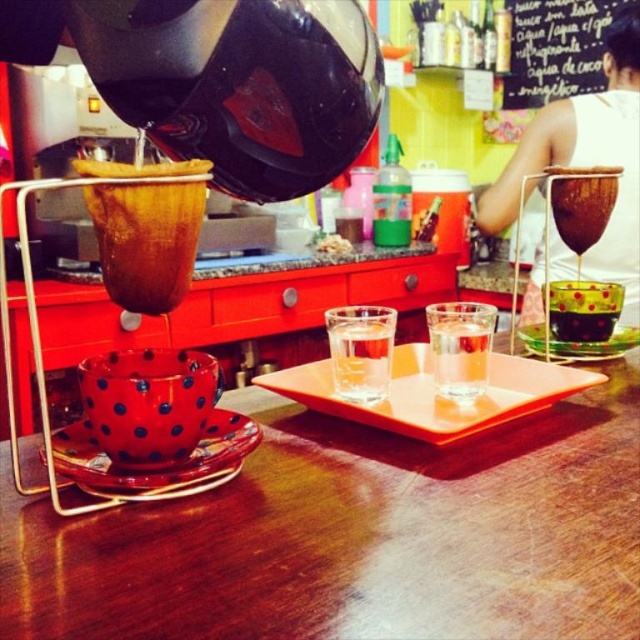
Question: Can you confirm if black chalkboard at upper center is positioned below wooden spoon at upper center?

Choices:
 (A) yes
 (B) no

Answer: (B)

Question: Which of these objects is positioned farthest from the polka dot glass at lower left?

Choices:
 (A) clear glass at center
 (B) translucent glass cup at center

Answer: (B)

Question: Considering the relative positions of wooden table at center and black chalkboard at upper center in the image provided, where is wooden table at center located with respect to black chalkboard at upper center?

Choices:
 (A) below
 (B) above

Answer: (A)

Question: Which point is closer to the camera?

Choices:
 (A) (102, 176)
 (B) (563, 330)
 (C) (593, 499)

Answer: (A)

Question: Which point is farther to the camera?

Choices:
 (A) polka dot glass at center
 (B) transparent glass at upper right
 (C) black chalkboard at upper center

Answer: (C)

Question: Can you confirm if wooden table at center is positioned to the right of polka dot glass at center?

Choices:
 (A) no
 (B) yes

Answer: (A)